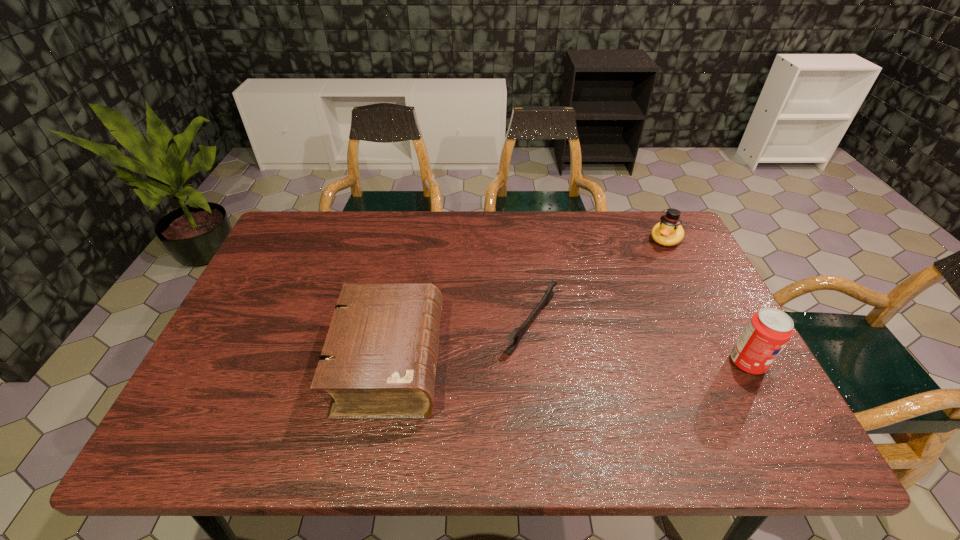
Where is `vacant area that lies between the Bible and the soda can`? The width and height of the screenshot is (960, 540). vacant area that lies between the Bible and the soda can is located at coordinates (568, 363).

Select which object is the closest to the leftmost object. Please provide its 2D coordinates. Your answer should be formatted as a tuple, i.e. [(x, y)], where the tuple contains the x and y coordinates of a point satisfying the conditions above.

[(516, 334)]

The height and width of the screenshot is (540, 960). Identify the location of the second closest object relative to the leftmost object. (668, 232).